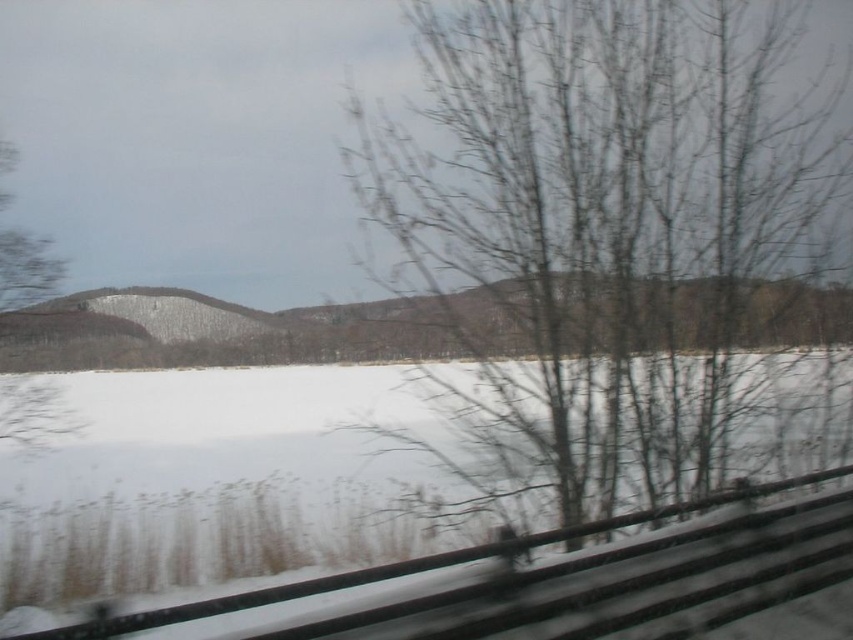
You are a passenger in a car driving along a snowy road. You notice two points marked on your map. The first point is at coordinates point [187,538] and the second point is at point [6,307]. According to the scene, which point is farther from the car?

Point [187,538] is behind point [6,307], so the point [187,538] is farther from the car.

You are a photographer planning to capture a wide landscape shot of the white matte snow at center and the green matte tree at left. Based on their sizes in the image, which object would appear wider in the photo?

The white matte snow at center would appear wider in the photo because its width surpasses that of the green matte tree at left.

You are a photographer planning to capture a landscape shot of the winter scene. You want to ensure that both the bare branches at center and the green matte tree at left are clearly visible in your composition. Based on their positions, which object should you focus on first to ensure both are in focus?

The green matte tree at left is above the bare branches at center, so focusing on the green matte tree at left first would help ensure both are in focus as it is farther away.